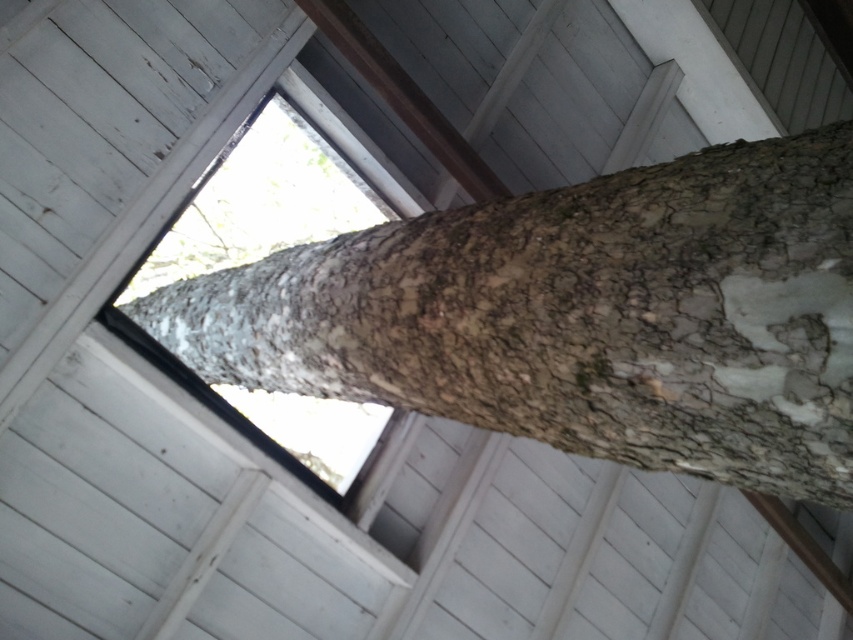
You are a painter standing in front of the rough bark tree at center and the transparent glass window at center. You want to paint both objects on a canvas. Which object should you paint first if you want to start with the smaller one?

The rough bark tree at center is smaller than the transparent glass window at center, so you should paint the rough bark tree at center first.

You are standing in front of the rough bark tree at center and the transparent glass window at center. Which object would appear larger to you?

The rough bark tree at center would appear larger because it is closer to the viewer than the transparent glass window at center.

You are a painter standing in front of the rough bark tree at center and the transparent glass window at center. You want to paint both objects. Which object will require more paint to cover its surface area?

The rough bark tree at center has a rough and textured surface, which means it has more surface area compared to the smooth transparent glass window at center. Therefore, the rough bark tree at center will require more paint to cover its surface area.